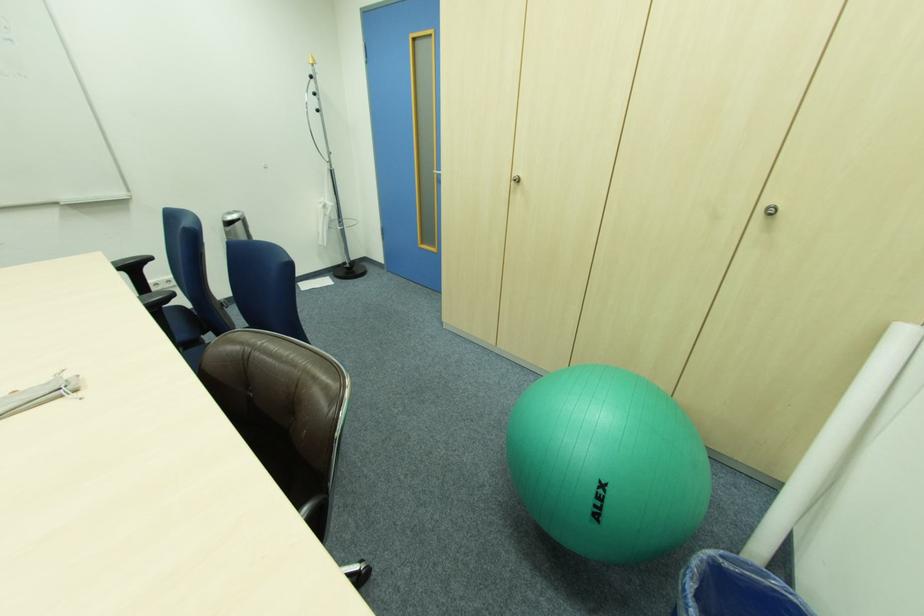
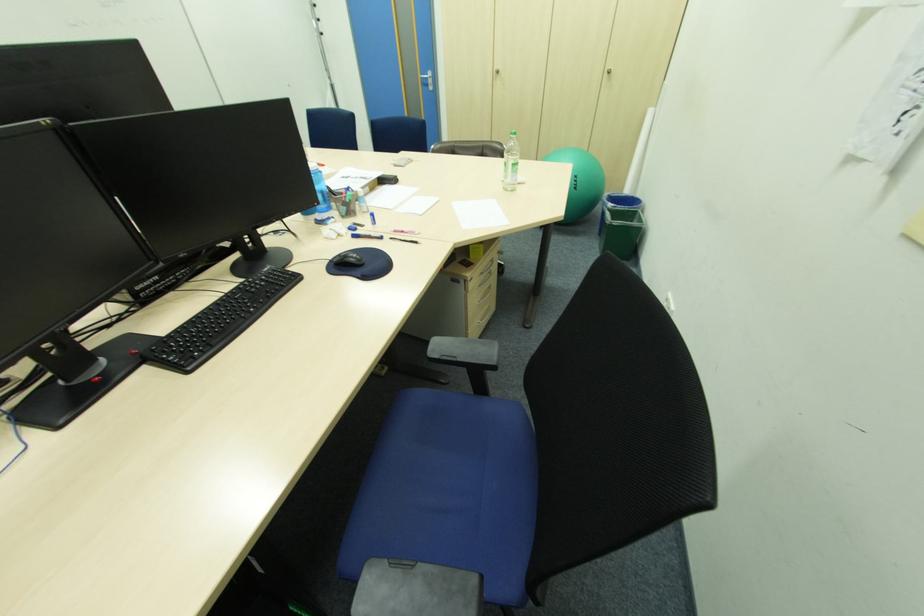
Find the pixel in the second image that matches point 773,229 in the first image.

(615, 79)